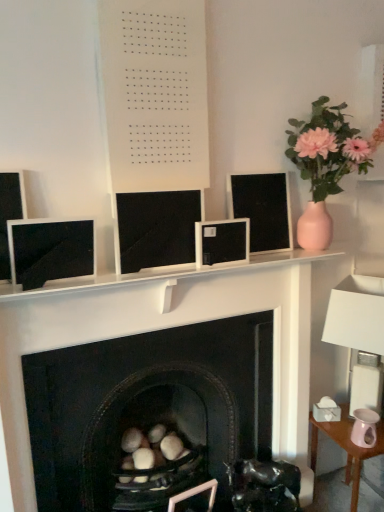
Question: From the image's perspective, is matte black monitor at left, the first computer monitor positioned from the left, positioned above or below white fabric lampshade at right?

Choices:
 (A) above
 (B) below

Answer: (A)

Question: Considering the positions of matte black monitor at left, which is counted as the 4th computer monitor, starting from the right, and white fabric lampshade at right in the image, is matte black monitor at left, which is counted as the 4th computer monitor, starting from the right, bigger or smaller than white fabric lampshade at right?

Choices:
 (A) small
 (B) big

Answer: (A)

Question: Which object is the farthest from the black matte monitor at center, the 2th computer monitor viewed from the left?

Choices:
 (A) black matte fireplace at center
 (B) pink ceramic table at lower right
 (C) satin black frame at center, which is counted as the 2th computer monitor, starting from the right
 (D) black glossy swivel chair at center
 (E) white fabric lampshade at right

Answer: (B)

Question: Based on their relative distances, which object is farther from the black matte fireplace at center?

Choices:
 (A) black matte frame at upper center, the 4th computer monitor when ordered from left to right
 (B) pink ceramic vase at upper right
 (C) white matte board at upper center
 (D) white fabric lampshade at right
 (E) satin black frame at center, which is counted as the 2th computer monitor, starting from the right

Answer: (C)